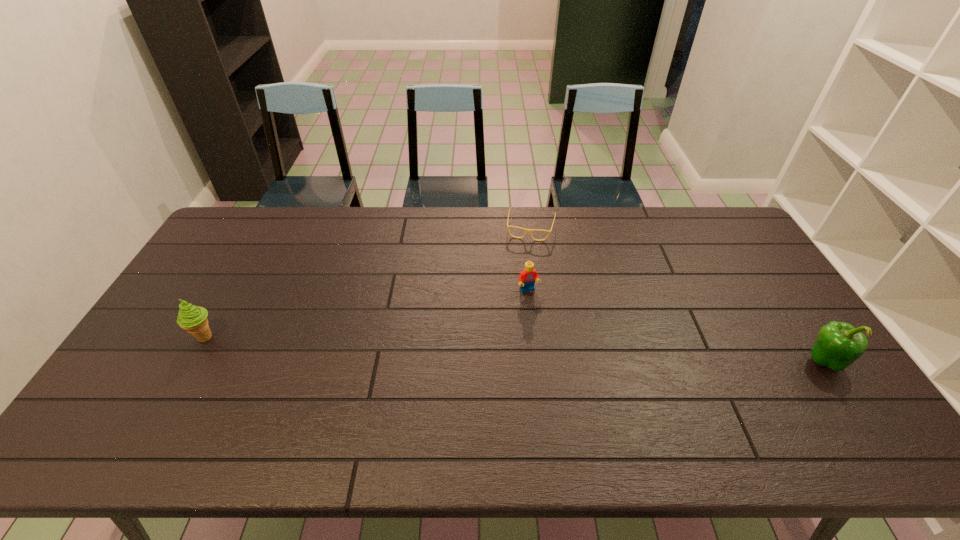
At what (x,y) coordinates should I click in order to perform the action: click on the leftmost object. Please return your answer as a coordinate pair (x, y). Looking at the image, I should click on (193, 319).

You are a GUI agent. You are given a task and a screenshot of the screen. Output one action in this format:
    pyautogui.click(x=<x>, y=<y>)
    Task: Click on the bell pepper
    
    Given the screenshot: What is the action you would take?
    pyautogui.click(x=838, y=345)

At what (x,y) coordinates should I click in order to perform the action: click on Lego. Please return your answer as a coordinate pair (x, y). Looking at the image, I should click on (527, 277).

What are the coordinates of `the third tallest object` in the screenshot? It's located at (527, 277).

This screenshot has height=540, width=960. I want to click on the farthest object, so click(x=526, y=230).

Locate an element on the screen. The height and width of the screenshot is (540, 960). spectacles is located at coordinates coord(526,230).

Identify the location of free space located 0.200m on the back of the icecream. (238, 279).

In order to click on vacant space situated 0.160m on the back of the rightmost object in this screenshot , I will do `click(784, 303)`.

Where is `blank area located 0.260m on the face of the Lego`? blank area located 0.260m on the face of the Lego is located at coordinates (565, 363).

Identify the location of free space located 0.240m on the face of the Lego. This screenshot has width=960, height=540. (563, 357).